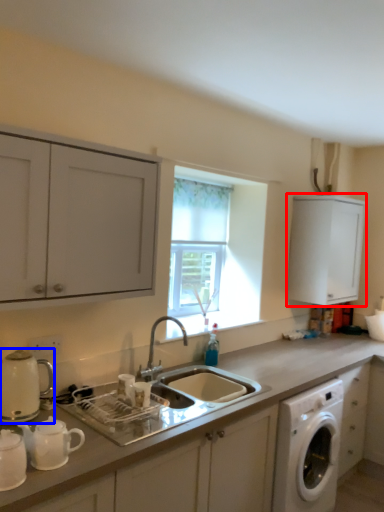
Question: Which of the following is the closest to the observer, cabinetry (highlighted by a red box) or appliance (highlighted by a blue box)?

Choices:
 (A) cabinetry
 (B) appliance

Answer: (B)